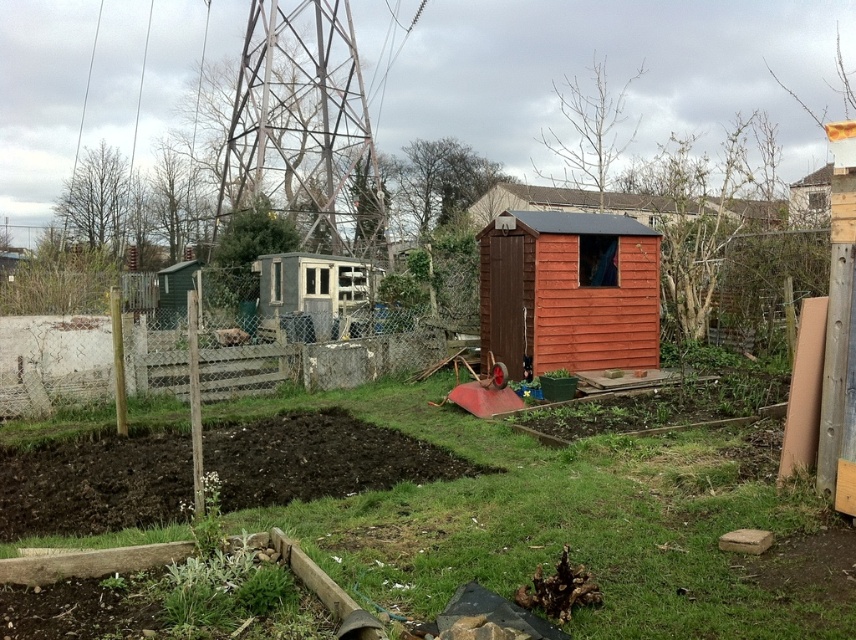
Who is more distant from viewer, (432, 342) or (290, 307)?

Point (290, 307)

Can you confirm if wooden fence at center is positioned to the right of rusty metal shed at center?

Indeed, wooden fence at center is positioned on the right side of rusty metal shed at center.

Find the location of `wooden fence at center`. wooden fence at center is located at coordinates (318, 362).

Between orange wood shed at center and wooden fence at center, which one is positioned higher?

Positioned higher is orange wood shed at center.

Is the position of orange wood shed at center more distant than that of wooden fence at center?

No, it is not.

Describe the element at coordinates (568, 291) in the screenshot. I see `orange wood shed at center` at that location.

This screenshot has width=856, height=640. Find the location of `orange wood shed at center`. orange wood shed at center is located at coordinates (568, 291).

Does orange wood shed at center appear under rusty metal shed at center?

Indeed, orange wood shed at center is positioned under rusty metal shed at center.

Is point (623, 250) positioned behind point (260, 272)?

No, (623, 250) is in front of (260, 272).

Identify the location of orange wood shed at center. (568, 291).